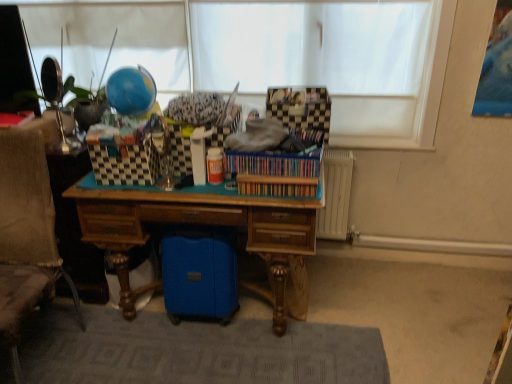
Question: Considering the relative sizes of gray textured rug at lower center and wooden desk at center in the image provided, is gray textured rug at lower center thinner than wooden desk at center?

Choices:
 (A) no
 (B) yes

Answer: (A)

Question: Can you see gray textured rug at lower center touching wooden desk at center?

Choices:
 (A) yes
 (B) no

Answer: (B)

Question: Can you confirm if gray textured rug at lower center is shorter than wooden desk at center?

Choices:
 (A) yes
 (B) no

Answer: (A)

Question: Can you confirm if gray textured rug at lower center is positioned to the right of wooden desk at center?

Choices:
 (A) yes
 (B) no

Answer: (B)

Question: Can you confirm if gray textured rug at lower center is smaller than wooden desk at center?

Choices:
 (A) yes
 (B) no

Answer: (A)

Question: In terms of height, does wooden bookshelf at center, the first book positioned from the bottom, look taller or shorter compared to wooden desk at center?

Choices:
 (A) tall
 (B) short

Answer: (B)

Question: Considering their positions, is wooden bookshelf at center, the first book positioned from the bottom, located in front of or behind wooden desk at center?

Choices:
 (A) front
 (B) behind

Answer: (B)

Question: Is point (267, 188) closer or farther from the camera than point (276, 264)?

Choices:
 (A) farther
 (B) closer

Answer: (B)

Question: From a real-world perspective, is wooden bookshelf at center, which appears as the second book when viewed from the top, positioned above or below wooden desk at center?

Choices:
 (A) below
 (B) above

Answer: (B)

Question: Considering the positions of textured beige fabric swivel chair at left and gray textured rug at lower center in the image, is textured beige fabric swivel chair at left bigger or smaller than gray textured rug at lower center?

Choices:
 (A) small
 (B) big

Answer: (B)

Question: Based on their positions, is textured beige fabric swivel chair at left located to the left or right of gray textured rug at lower center?

Choices:
 (A) left
 (B) right

Answer: (A)

Question: Is point (54, 279) positioned closer to the camera than point (82, 379)?

Choices:
 (A) closer
 (B) farther

Answer: (A)

Question: From the image's perspective, is textured beige fabric swivel chair at left above or below gray textured rug at lower center?

Choices:
 (A) above
 (B) below

Answer: (A)

Question: Is wooden bookshelf at center, the first book positioned from the bottom, wider or thinner than checkerboard-patterned fabric at upper center?

Choices:
 (A) wide
 (B) thin

Answer: (A)

Question: Which is correct: wooden bookshelf at center, which appears as the second book when viewed from the top, is inside checkerboard-patterned fabric at upper center, or outside of it?

Choices:
 (A) outside
 (B) inside

Answer: (A)